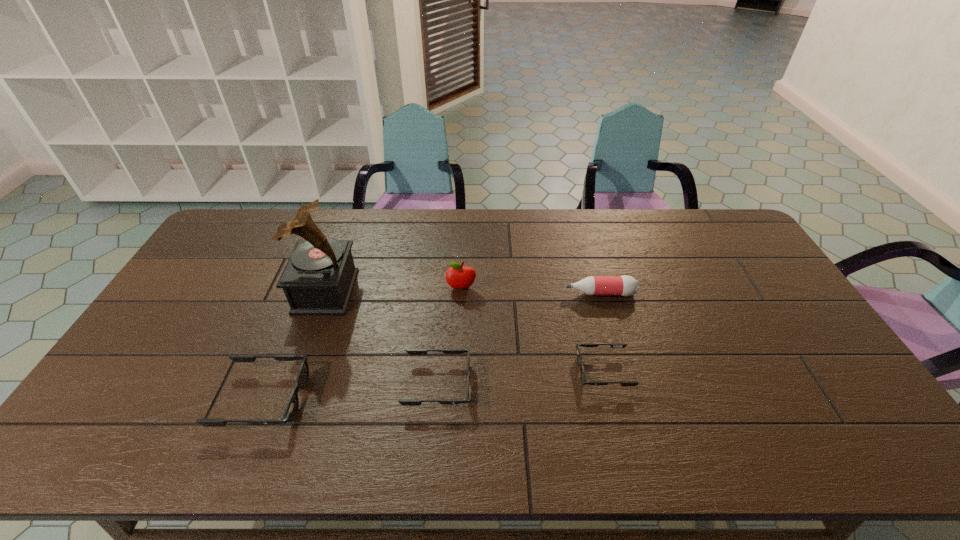
This screenshot has height=540, width=960. Identify the location of free point between the leftmost sunglasses and the fifth tallest object. (350, 392).

What are the coordinates of `empty space that is in between the fifth shortest object and the second tallest sunglasses` in the screenshot? It's located at (449, 336).

Where is `object that is the closest to the rightmost sunglasses`? Image resolution: width=960 pixels, height=540 pixels. object that is the closest to the rightmost sunglasses is located at coordinates (625, 285).

This screenshot has height=540, width=960. I want to click on object that is the closest to the fifth shortest object, so click(405, 402).

Image resolution: width=960 pixels, height=540 pixels. What are the coordinates of `sunglasses that can be found as the second closest to the tallest sunglasses` in the screenshot? It's located at (613, 345).

You are a GUI agent. You are given a task and a screenshot of the screen. Output one action in this format:
    pyautogui.click(x=<x>, y=<y>)
    Task: Click on the third closest sunglasses to the second tallest object
    Image resolution: width=960 pixels, height=540 pixels.
    Given the screenshot: What is the action you would take?
    pyautogui.click(x=291, y=409)